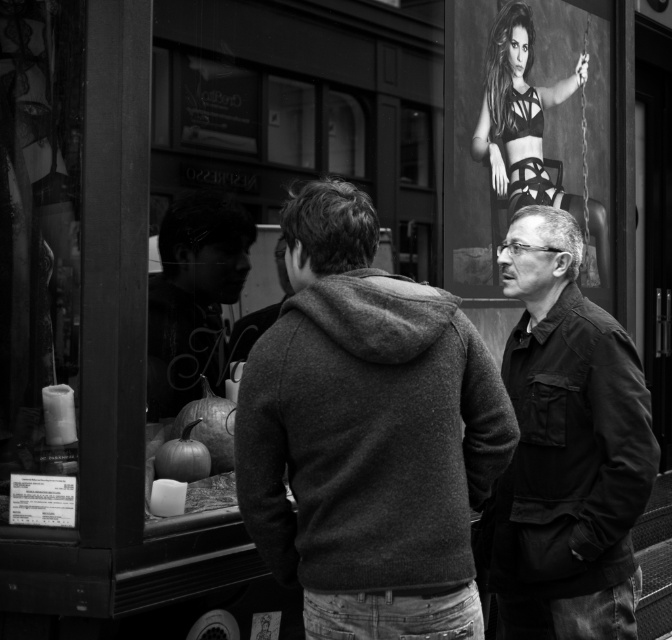
Between textured gray hoodie at center and matte black bra at upper center, which one has less height?

matte black bra at upper center

Does textured gray hoodie at center have a greater height compared to matte black bra at upper center?

Indeed, textured gray hoodie at center has a greater height compared to matte black bra at upper center.

Image resolution: width=672 pixels, height=640 pixels. Describe the element at coordinates (368, 435) in the screenshot. I see `textured gray hoodie at center` at that location.

Find the location of a particular element. The width and height of the screenshot is (672, 640). textured gray hoodie at center is located at coordinates (368, 435).

Can you confirm if textured gray hoodie at center is bigger than smooth black hoodie at center?

Indeed, textured gray hoodie at center has a larger size compared to smooth black hoodie at center.

Between textured gray hoodie at center and smooth black hoodie at center, which one is positioned higher?

smooth black hoodie at center is higher up.

The height and width of the screenshot is (640, 672). What do you see at coordinates (368, 435) in the screenshot?
I see `textured gray hoodie at center` at bounding box center [368, 435].

Identify the location of textured gray hoodie at center. This screenshot has height=640, width=672. (368, 435).

Who is more forward, (509, 515) or (503, 40)?

Point (509, 515)

Can you confirm if textured black jacket at right is taller than matte black bra at upper center?

Correct, textured black jacket at right is much taller as matte black bra at upper center.

Is point (573, 392) positioned behind point (521, 60)?

No, (573, 392) is in front of (521, 60).

I want to click on textured black jacket at right, so click(566, 449).